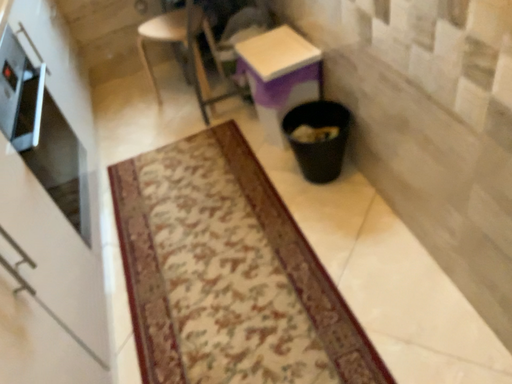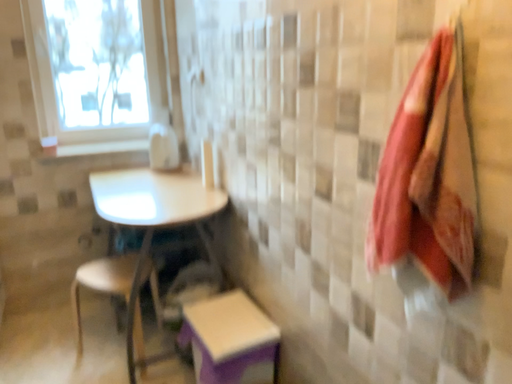
Question: Which way did the camera rotate in the video?

Choices:
 (A) rotated downward
 (B) rotated upward

Answer: (B)